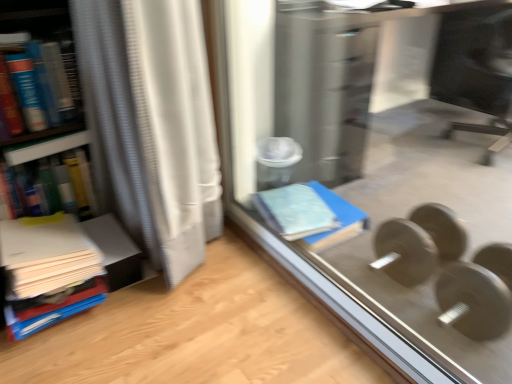
At what (x,y) coordinates should I click in order to perform the action: click on free area in between metallic gray dumbbell at lower right, which is counted as the second dumbbell, starting from the front, and matte gray dumbbell at lower right, arranged as the 2th dumbbell when viewed from the back. Please return your answer as a coordinate pair (x, y). This screenshot has width=512, height=384. Looking at the image, I should click on (426, 277).